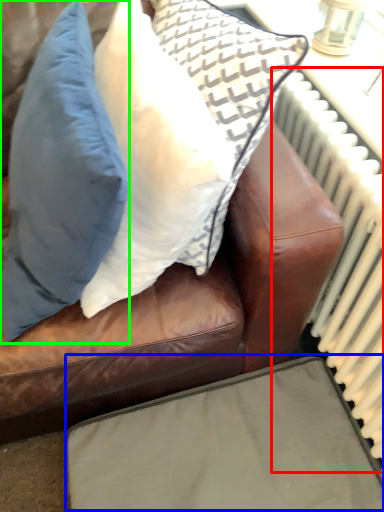
Question: Which object is the farthest from radiator (highlighted by a red box)? Choose among these: furniture (highlighted by a blue box) or pillow (highlighted by a green box).

Choices:
 (A) furniture
 (B) pillow

Answer: (B)